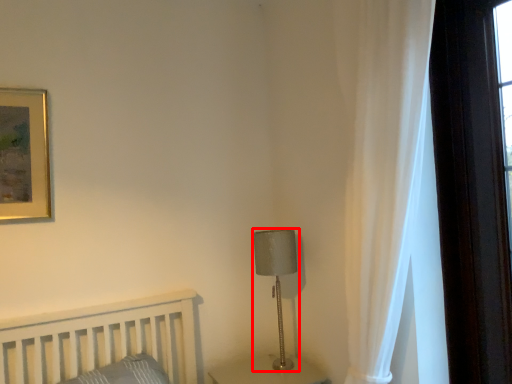
Question: From the image's perspective, what is the correct spatial positioning of table lamp (annotated by the red box) in reference to curtain?

Choices:
 (A) below
 (B) above

Answer: (A)